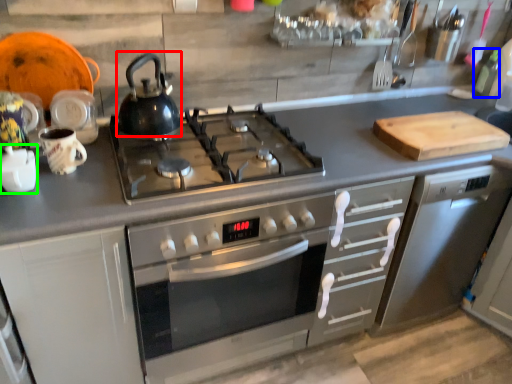
Question: Which object is positioned closest to kettle (highlighted by a red box)? Select from bottle (highlighted by a blue box) and appliance (highlighted by a green box).

Choices:
 (A) bottle
 (B) appliance

Answer: (B)